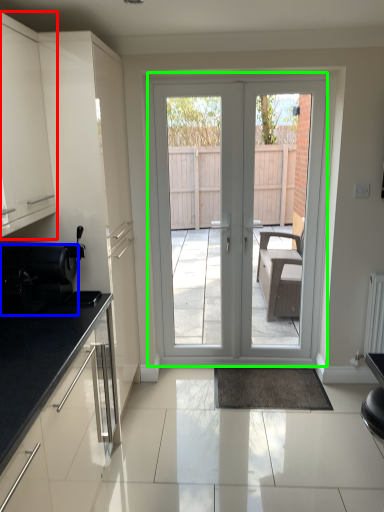
Question: Considering the real-world distances, which object is closest to cabinetry (highlighted by a red box)? appliance (highlighted by a blue box) or door (highlighted by a green box).

Choices:
 (A) appliance
 (B) door

Answer: (A)